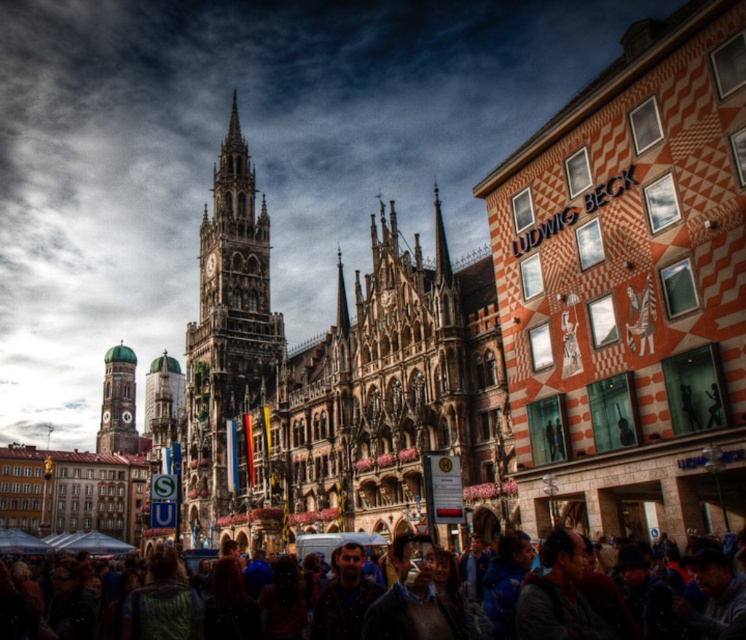
Does stone gothic church at center lie behind gold-plated clock tower at left?

No, stone gothic church at center is closer to the viewer.

Is stone gothic church at center below gold-plated clock tower at left?

Incorrect, stone gothic church at center is not positioned below gold-plated clock tower at left.

This screenshot has height=640, width=746. I want to click on stone gothic church at center, so click(x=336, y=385).

At what (x,y) coordinates should I click in order to perform the action: click on stone gothic church at center. Please return your answer as a coordinate pair (x, y). The width and height of the screenshot is (746, 640). Looking at the image, I should click on (336, 385).

Is point (275, 529) farther from camera compared to point (125, 435)?

No, it is not.

Which is more to the right, dark stone clock tower at center or gold-plated clock tower at left?

Positioned to the right is dark stone clock tower at center.

Which is in front, point (236, 406) or point (131, 358)?

Point (236, 406) is in front.

At what (x,y) coordinates should I click in order to perform the action: click on dark stone clock tower at center. Please return your answer as a coordinate pair (x, y). This screenshot has width=746, height=640. Looking at the image, I should click on (231, 356).

Does dark stone clock tower at center have a lesser height compared to multicolored fabric crowd at center?

No, dark stone clock tower at center is not shorter than multicolored fabric crowd at center.

Does dark stone clock tower at center lie behind multicolored fabric crowd at center?

Yes, it is behind multicolored fabric crowd at center.

The image size is (746, 640). What do you see at coordinates (231, 356) in the screenshot? I see `dark stone clock tower at center` at bounding box center [231, 356].

Where is `dark stone clock tower at center`? dark stone clock tower at center is located at coordinates click(231, 356).